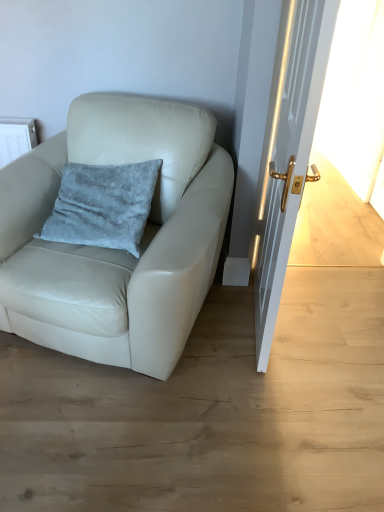
Find the location of `white glossy door at right`. white glossy door at right is located at coordinates (288, 150).

Locate an element on the screen. The image size is (384, 512). white leather chair at left is located at coordinates (112, 249).

Find the location of a particular element. The height and width of the screenshot is (512, 384). velvety blue pillow at center-left is located at coordinates (103, 205).

Image resolution: width=384 pixels, height=512 pixels. In order to click on white glossy door at right in this screenshot , I will do pos(288,150).

You are a GUI agent. You are given a task and a screenshot of the screen. Output one action in this format:
    pyautogui.click(x=<x>, y=<y>)
    Task: Click on the pillow below the white glossy door at right (from a real-world perspective)
    This screenshot has width=384, height=512.
    Given the screenshot: What is the action you would take?
    pyautogui.click(x=103, y=205)

Is velvety blue pillow at center-left bigger than white glossy door at right?

Actually, velvety blue pillow at center-left might be smaller than white glossy door at right.

From a real-world perspective, is velvety blue pillow at center-left located higher than white glossy door at right?

No, from a real-world perspective, velvety blue pillow at center-left is not on top of white glossy door at right.

From the image's perspective, is white glossy door at right above or below white leather chair at left?

white glossy door at right is above white leather chair at left.

Is white glossy door at right in contact with white leather chair at left?

white glossy door at right and white leather chair at left are clearly separated.

Which of these two, white glossy door at right or white leather chair at left, is bigger?

white leather chair at left is bigger.

Is white leather chair at left beside white glossy door at right?

white leather chair at left is not next to white glossy door at right, and they're not touching.

At what (x,y) coordinates should I click in order to perform the action: click on door that is on the right side of white leather chair at left. Please return your answer as a coordinate pair (x, y). This screenshot has width=384, height=512. Looking at the image, I should click on (288, 150).

Based on the photo, is white leather chair at left positioned before white glossy door at right?

No, the depth of white leather chair at left is greater than that of white glossy door at right.

From a real-world perspective, is white leather chair at left over white glossy door at right?

Actually, white leather chair at left is physically below white glossy door at right in the real world.

Does velvety blue pillow at center-left appear on the right side of white leather chair at left?

Incorrect, velvety blue pillow at center-left is not on the right side of white leather chair at left.

How distant is velvety blue pillow at center-left from white leather chair at left?

A distance of 6.92 inches exists between velvety blue pillow at center-left and white leather chair at left.

Can you confirm if velvety blue pillow at center-left is shorter than white leather chair at left?

Correct, velvety blue pillow at center-left is not as tall as white leather chair at left.

Is white leather chair at left inside velvety blue pillow at center-left?

Definitely not — white leather chair at left is not inside velvety blue pillow at center-left.

Can you confirm if white glossy door at right is thinner than velvety blue pillow at center-left?

Yes.

Which is more to the right, white glossy door at right or velvety blue pillow at center-left?

white glossy door at right.

From the image's perspective, is white glossy door at right on velvety blue pillow at center-left?

Indeed, from the image's perspective, white glossy door at right is shown above velvety blue pillow at center-left.

Would you say white glossy door at right is a long distance from velvety blue pillow at center-left?

Actually, white glossy door at right and velvety blue pillow at center-left are a little close together.

Could velvety blue pillow at center-left be considered to be inside white leather chair at left?

Yes, velvety blue pillow at center-left is surrounded by white leather chair at left.

Consider the image. Is white leather chair at left far from velvety blue pillow at center-left?

They are positioned close to each other.

Between point (97, 328) and point (53, 234), which one is positioned behind?

The point (53, 234) is behind.

Which of these two, white leather chair at left or velvety blue pillow at center-left, stands taller?

Standing taller between the two is white leather chair at left.

Locate an element on the screen. The image size is (384, 512). pillow that is on the left side of white glossy door at right is located at coordinates (103, 205).

Locate an element on the screen. The image size is (384, 512). door lying in front of the white leather chair at left is located at coordinates (288, 150).

From the picture: Looking at the image, which one is located further to white glossy door at right, white leather chair at left or velvety blue pillow at center-left?

The object further to white glossy door at right is velvety blue pillow at center-left.

Which object lies further to the anchor point velvety blue pillow at center-left, white leather chair at left or white glossy door at right?

Based on the image, white glossy door at right appears to be further to velvety blue pillow at center-left.

Which object lies nearer to the anchor point white leather chair at left, white glossy door at right or velvety blue pillow at center-left?

Among the two, velvety blue pillow at center-left is located nearer to white leather chair at left.

Which object lies nearer to the anchor point velvety blue pillow at center-left, white glossy door at right or white leather chair at left?

white leather chair at left is positioned closer to the anchor velvety blue pillow at center-left.

When comparing their distances from white glossy door at right, does velvety blue pillow at center-left or white leather chair at left seem further?

velvety blue pillow at center-left is further to white glossy door at right.

Which object lies further to the anchor point white leather chair at left, velvety blue pillow at center-left or white glossy door at right?

The object further to white leather chair at left is white glossy door at right.

What are the coordinates of `chair between velvety blue pillow at center-left and white glossy door at right` in the screenshot? It's located at (112, 249).